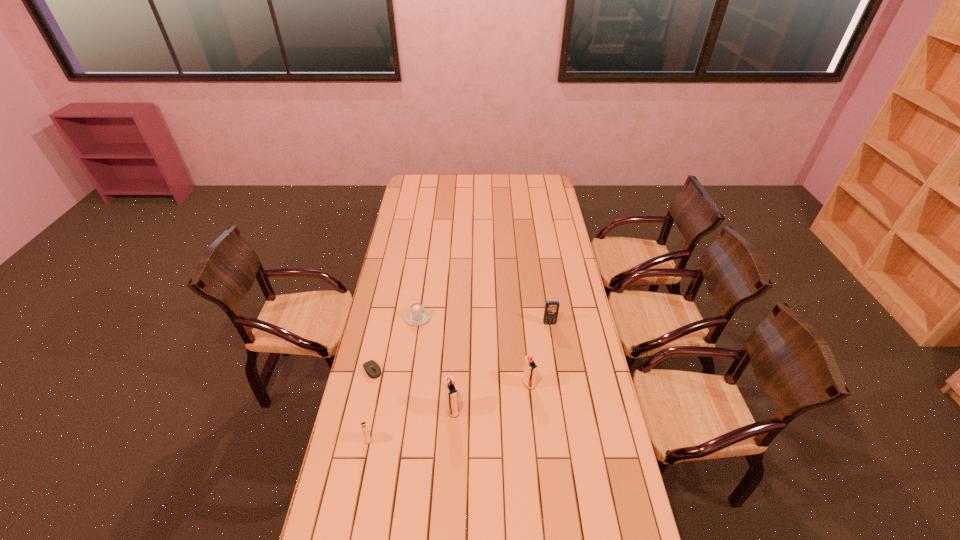
Where is `the nearest object`? Image resolution: width=960 pixels, height=540 pixels. the nearest object is located at coordinates (364, 428).

Where is `the fourth tallest object`? the fourth tallest object is located at coordinates (364, 428).

Locate an element on the screen. The image size is (960, 540). the second nearest object is located at coordinates (451, 393).

The height and width of the screenshot is (540, 960). Find the location of `the second nearest igniter`. the second nearest igniter is located at coordinates (451, 393).

This screenshot has height=540, width=960. In order to click on the second object from right to left in this screenshot , I will do `click(530, 368)`.

Locate an element on the screen. The height and width of the screenshot is (540, 960). the rightmost igniter is located at coordinates (530, 368).

Locate an element on the screen. This screenshot has height=540, width=960. the third object from left to right is located at coordinates (417, 315).

You are a GUI agent. You are given a task and a screenshot of the screen. Output one action in this format:
    pyautogui.click(x=<x>, y=<y>)
    Task: Click on the second shortest object
    The width and height of the screenshot is (960, 540).
    Given the screenshot: What is the action you would take?
    pyautogui.click(x=417, y=315)

The image size is (960, 540). What are the coordinates of `the shortest object` in the screenshot? It's located at (373, 370).

Where is `cellular telephone`? The height and width of the screenshot is (540, 960). cellular telephone is located at coordinates (551, 310).